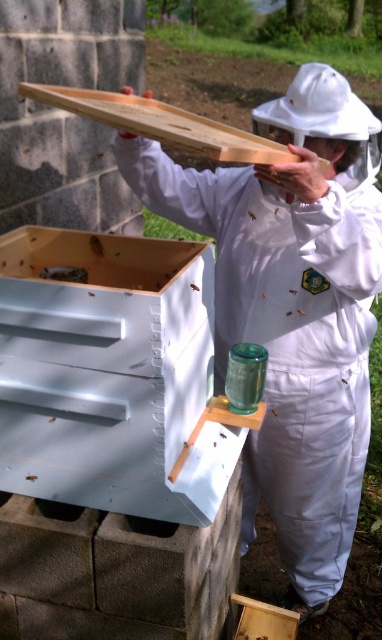
You are a beekeeper who needs to place a new frame into the hive. Based on the image, which object is closer to you, the white painted wood beehive at lower left or the translucent plastic bee at upper center?

The white painted wood beehive at lower left is closer to you because it is in front of the translucent plastic bee at upper center.

You are a beekeeper who needs to inspect the hive. You notice the white matte beekeeper suit at center and the translucent plastic bee at upper center. Which object is nearer to you as you stand in front of the hive?

The white matte beekeeper suit at center is closer to the viewer than the translucent plastic bee at upper center, so the white matte beekeeper suit at center is nearer to you.